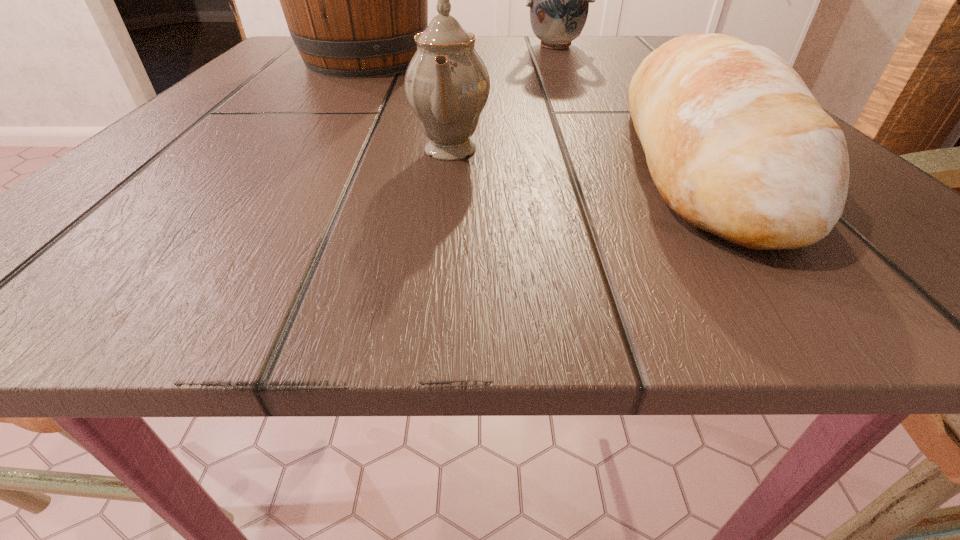
The image size is (960, 540). What are the coordinates of `free space between the second tallest object and the bread` in the screenshot? It's located at (626, 102).

This screenshot has height=540, width=960. In order to click on the second closest object to the third shortest object in this screenshot , I will do point(737,145).

The height and width of the screenshot is (540, 960). I want to click on the closest object to the second shortest object, so pos(737,145).

At what (x,y) coordinates should I click in order to perform the action: click on free space that satisfies the following two spatial constraints: 1. on the spout of the shortest object; 2. on the left side of the third tallest object. Please return your answer as a coordinate pair (x, y). Looking at the image, I should click on (x=449, y=159).

You are a GUI agent. You are given a task and a screenshot of the screen. Output one action in this format:
    pyautogui.click(x=<x>, y=<y>)
    Task: Click on the free space that satisfies the following two spatial constraints: 1. on the front side of the shortest object; 2. on the left side of the cider
    
    Given the screenshot: What is the action you would take?
    tap(299, 159)

At what (x,y) coordinates should I click in order to perform the action: click on free space in the image that satisfies the following two spatial constraints: 1. on the spout of the third tallest object; 2. on the right side of the bread. Please return your answer as a coordinate pair (x, y). The image size is (960, 540). Looking at the image, I should click on (449, 159).

At what (x,y) coordinates should I click in order to perform the action: click on free space that satisfies the following two spatial constraints: 1. on the spout of the chinaware; 2. on the back side of the bread. Please return your answer as a coordinate pair (x, y). The width and height of the screenshot is (960, 540). Looking at the image, I should click on (449, 159).

Locate an element on the screen. The height and width of the screenshot is (540, 960). vacant space that satisfies the following two spatial constraints: 1. on either side of the pottery; 2. on the left side of the bread is located at coordinates (610, 159).